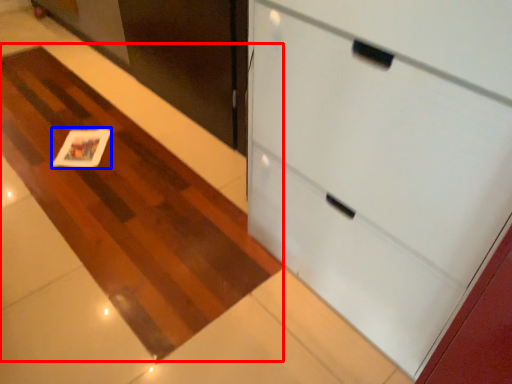
Question: Which point is further to the camera, plain (highlighted by a red box) or card (highlighted by a blue box)?

Choices:
 (A) plain
 (B) card

Answer: (B)